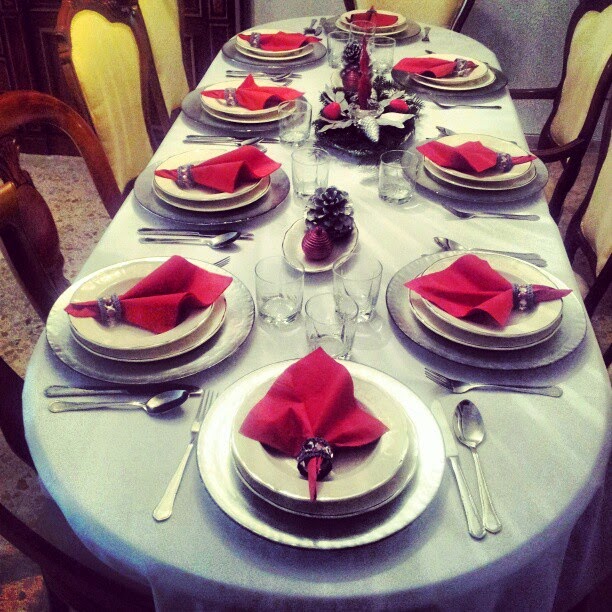
The width and height of the screenshot is (612, 612). I want to click on knives, so click(461, 497), click(84, 390), click(149, 229), click(192, 133), click(316, 28).